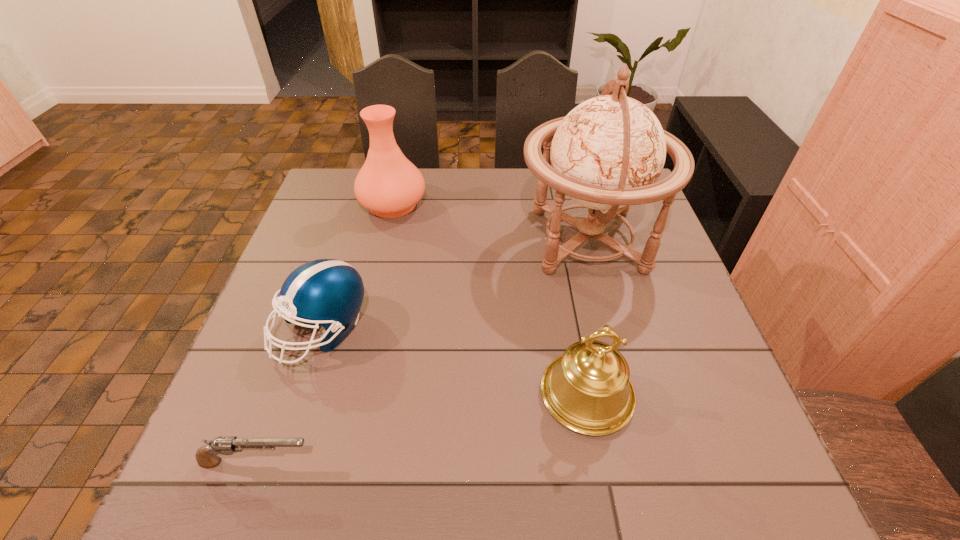
This screenshot has height=540, width=960. Identify the location of blank area located 0.090m on the right of the third shortest object. (679, 394).

You are a GUI agent. You are given a task and a screenshot of the screen. Output one action in this format:
    pyautogui.click(x=<x>, y=<y>)
    Task: Click on the vacant space located at the front of the football helmet with the faceguard
    
    Given the screenshot: What is the action you would take?
    pyautogui.click(x=269, y=498)

At what (x,y) coordinates should I click in order to perform the action: click on blank space located aiming along the barrel of the nearest object. Please return your answer as a coordinate pair (x, y). The width and height of the screenshot is (960, 540). Looking at the image, I should click on (366, 462).

Where is `globe at the far edge`? The height and width of the screenshot is (540, 960). globe at the far edge is located at coordinates (607, 153).

The height and width of the screenshot is (540, 960). Find the location of `vase positioned at the far edge`. vase positioned at the far edge is located at coordinates (389, 185).

I want to click on object situated at the near edge, so coord(206,456).

Locate an element on the screen. vase that is at the left edge is located at coordinates (389, 185).

Identify the location of football helmet located in the left edge section of the desktop. (328, 292).

You are a GUI agent. You are given a task and a screenshot of the screen. Output one action in this format:
    pyautogui.click(x=<x>, y=<y>)
    Task: Click on the gun present at the left edge
    This screenshot has width=960, height=540.
    Given the screenshot: What is the action you would take?
    pyautogui.click(x=206, y=456)

You are a GUI agent. You are given a task and a screenshot of the screen. Output one action in this format:
    pyautogui.click(x=<x>, y=<y>)
    Task: Click on the object that is at the right edge
    
    Given the screenshot: What is the action you would take?
    pyautogui.click(x=607, y=153)